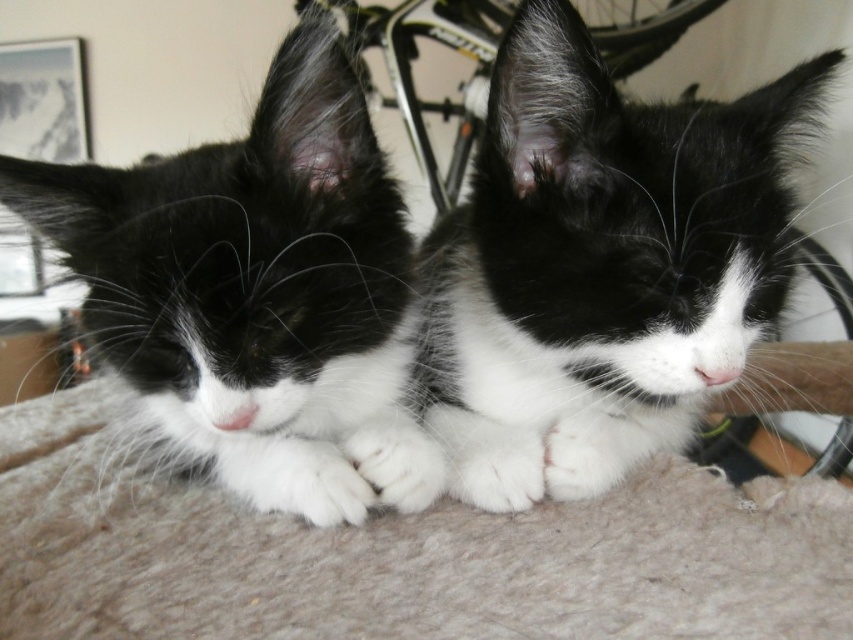
You are a photographer trying to capture a closeup of the cats. You notice two points in the image labeled as point [485,282] and point [192,268]. Which point should you focus on to ensure the cats are in sharp focus?

You should focus on point [485,282] because it is closer to the camera than point [192,268], ensuring the cats are in sharp focus.